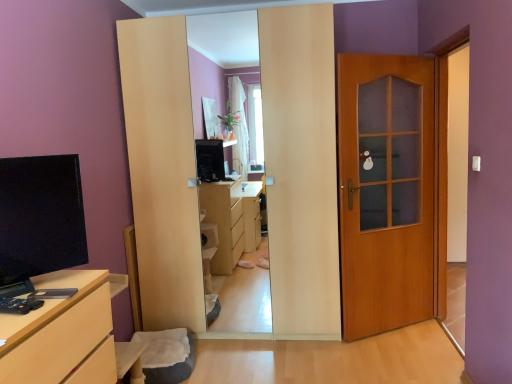
Question: Is wooden door at right inside the boundaries of matte wood chest of drawers at lower left, or outside?

Choices:
 (A) outside
 (B) inside

Answer: (A)

Question: In terms of height, does wooden door at right look taller or shorter compared to matte wood chest of drawers at lower left?

Choices:
 (A) short
 (B) tall

Answer: (B)

Question: Which is nearer to the matte black tv at left?

Choices:
 (A) matte wood chest of drawers at lower left
 (B) wooden door at right

Answer: (A)

Question: Estimate the real-world distances between objects in this image. Which object is closer to the matte black tv at left?

Choices:
 (A) wooden door at right
 (B) matte wood chest of drawers at lower left

Answer: (B)